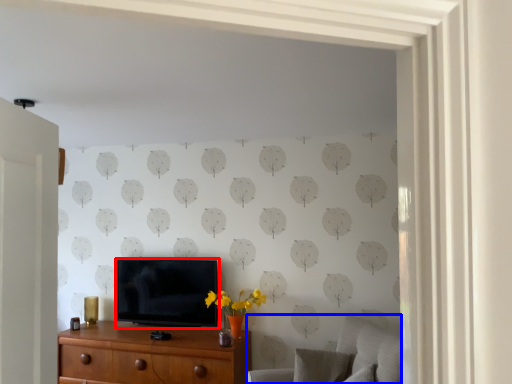
Question: Which object appears closest to the camera in this image, television (highlighted by a red box) or swivel chair (highlighted by a blue box)?

Choices:
 (A) television
 (B) swivel chair

Answer: (B)